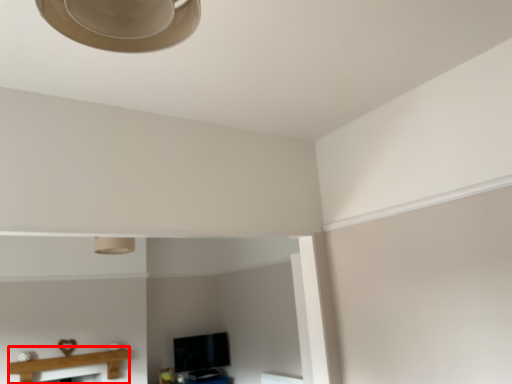
Question: From the image's perspective, considering the relative positions of table (annotated by the red box) and lamp in the image provided, where is table (annotated by the red box) located with respect to the staircase?

Choices:
 (A) below
 (B) above

Answer: (A)